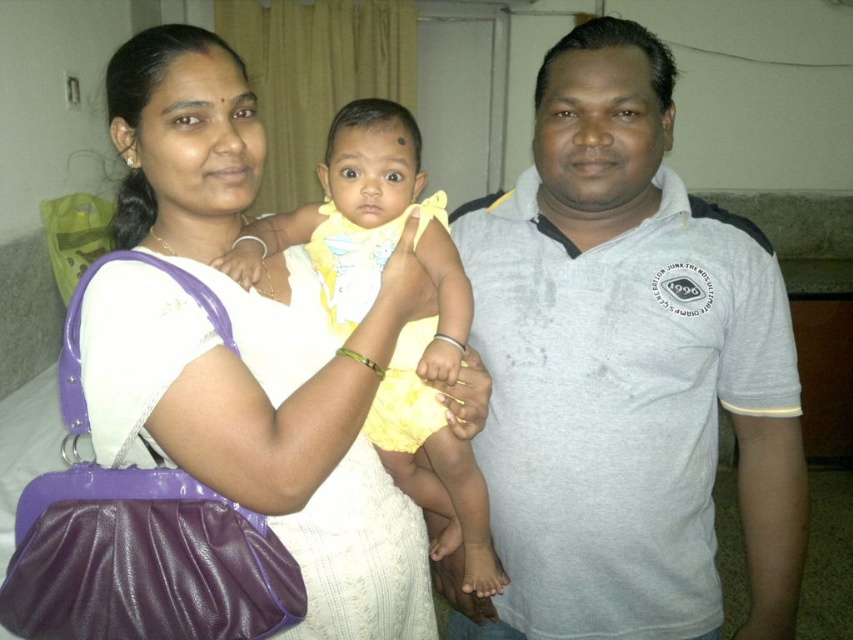
Please look at the image and locate the point at coordinates (625, 371). Which object is this point located on?

The point at coordinates (625, 371) is located on the gray cotton shirt at center.

You are a photographer setting up for a family photo shoot. You have two outfits to choose from for the mother figure in the scene. The gray cotton shirt at center and the matte white dress at center. Based on their sizes, which one would you recommend for a more relaxed, casual look?

The gray cotton shirt at center is bigger than the matte white dress at center, so the gray cotton shirt at center would be more suitable for a relaxed, casual look as it tends to have a looser fit compared to the dress.

You are standing in the living room and want to place a small decoration between the two points, point (x=200, y=321) and point (x=415, y=164). Which point should you place it closer to in order for it to be closer to the viewer?

You should place the decoration closer to point (x=200, y=321) because it is closer to the viewer than point (x=415, y=164).